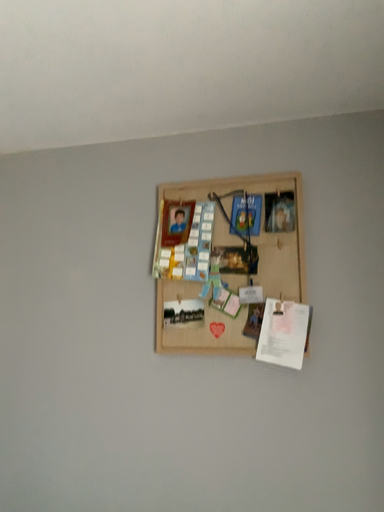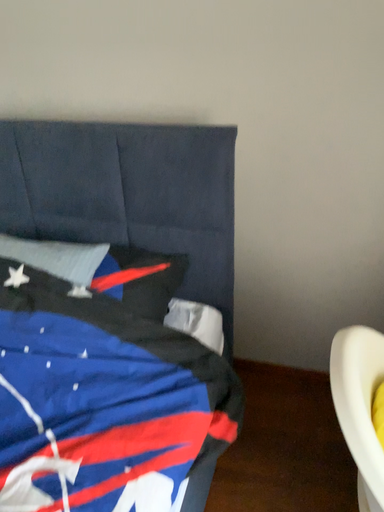
Question: Which way did the camera rotate in the video?

Choices:
 (A) rotated upward
 (B) rotated downward

Answer: (B)